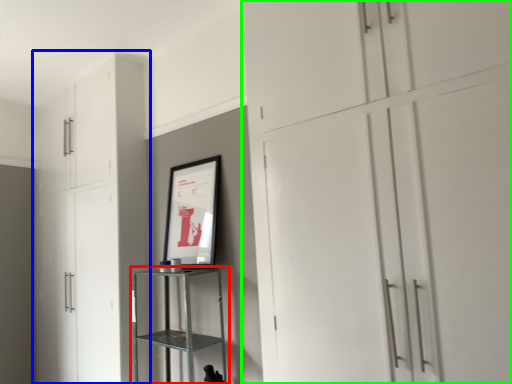
Question: Considering the real-world distances, which object is farthest from shelf (highlighted by a red box)? cupboard (highlighted by a blue box) or cupboard (highlighted by a green box)?

Choices:
 (A) cupboard
 (B) cupboard

Answer: (B)